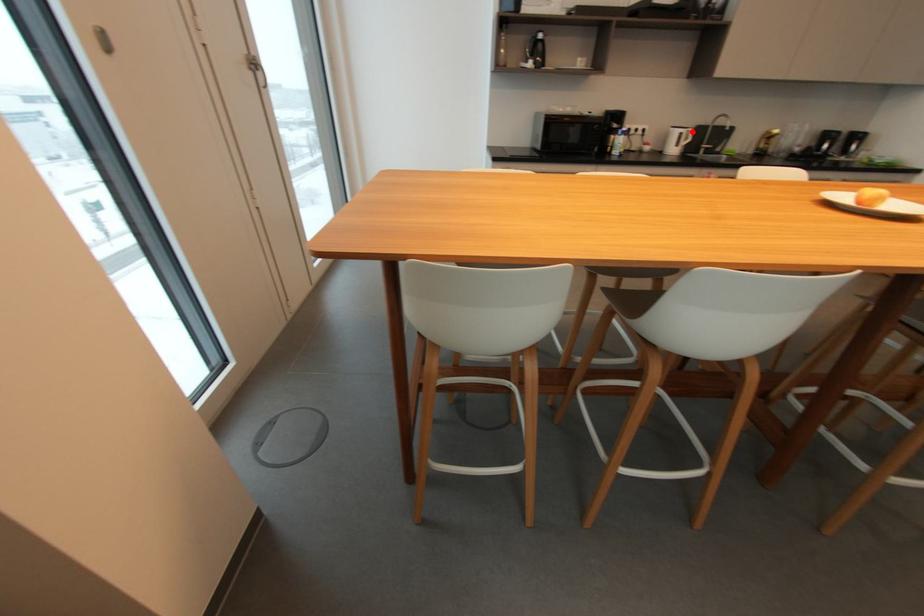
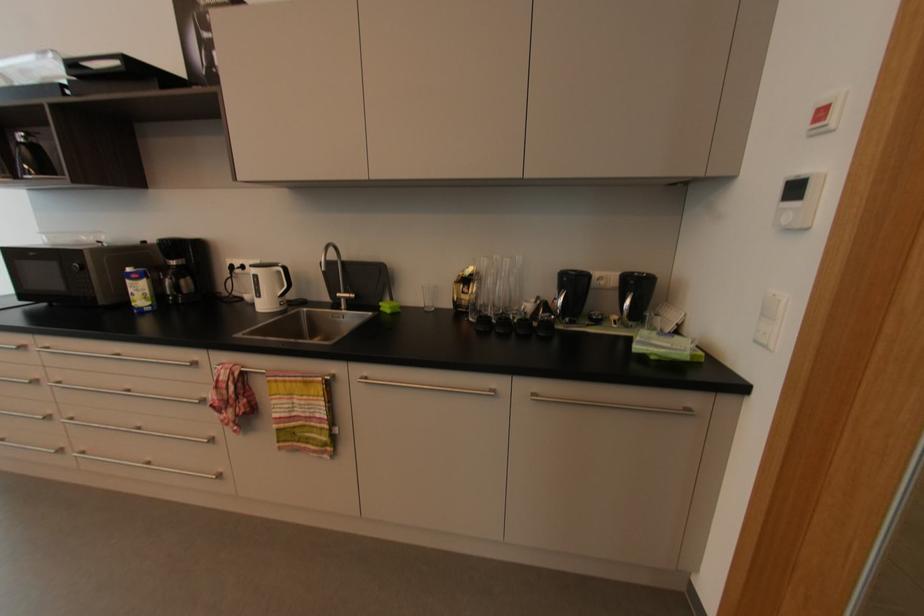
The point at the highlighted location is marked in the first image. Where is the corresponding point in the second image?

(282, 273)